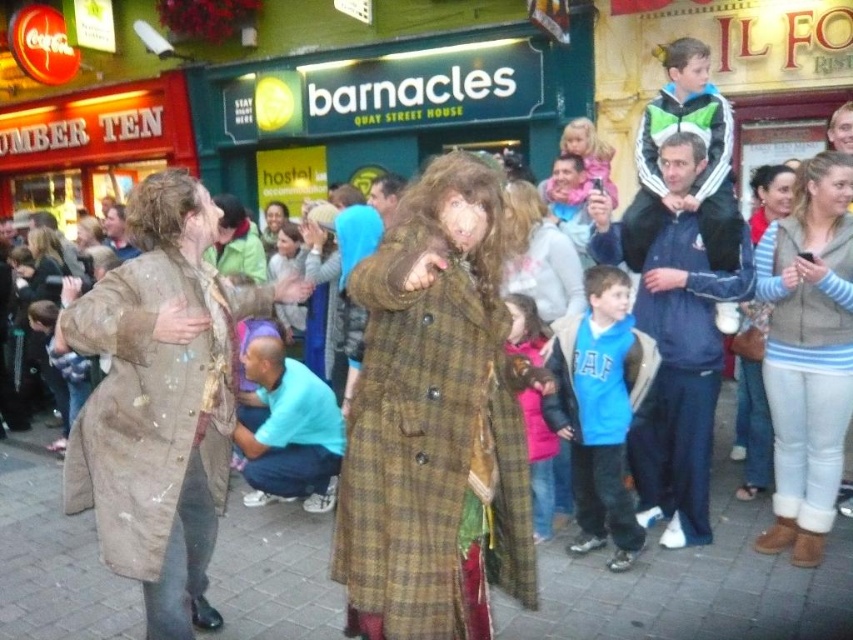
You are a photographer positioned at the center of the scene. You want to capture a photo focusing on the brown textured coat at left. Which direction should you move to get the best shot, considering its current position?

The brown textured coat at left is located at point (161, 401). To center it in your photo, move towards the left and slightly downward from your current position at the center.

You are a photographer trying to capture both the pink fleece jacket at center and the brown wool coat at center in a single frame. Based on their positions, which one is closer to the camera?

The pink fleece jacket at center is positioned under the brown wool coat at center, meaning it is closer to the camera.

From the picture: You are a photographer trying to capture both the light gray fleece vest at right and the pink fleece jacket at center in a single shot. Which of the two items should you focus on first to ensure both are in focus?

You should focus on the light gray fleece vest at right first because it is closer to you than the pink fleece jacket at center, so focusing on the closer object will help both be in focus.